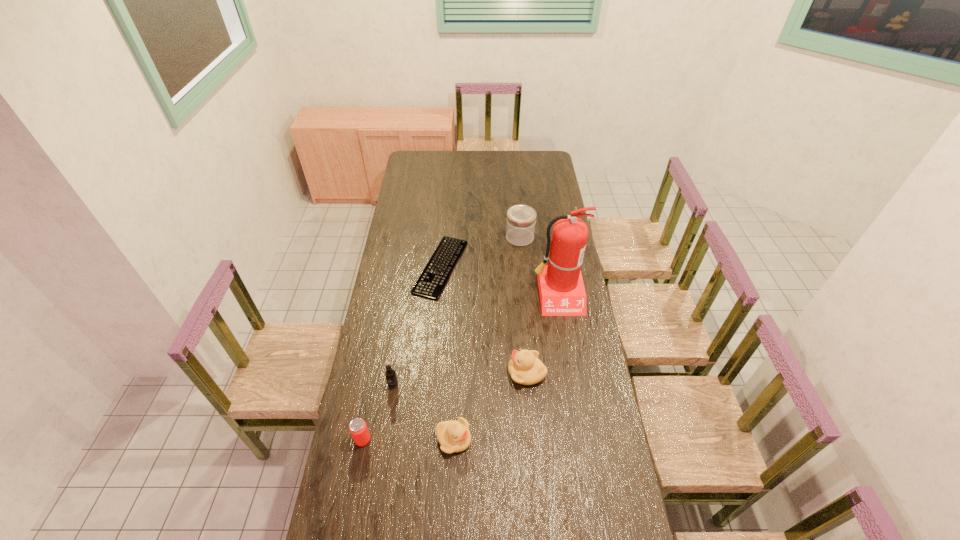
Find the location of `vacant area that satisfies the following two spatial constraints: 1. on the front-facing side of the fire extinguisher; 2. on the beak of the right duckling`. vacant area that satisfies the following two spatial constraints: 1. on the front-facing side of the fire extinguisher; 2. on the beak of the right duckling is located at coordinates (570, 373).

Identify the location of vacant region that satisfies the following two spatial constraints: 1. on the front-facing side of the fire extinguisher; 2. on the beak of the taller duckling. (570, 373).